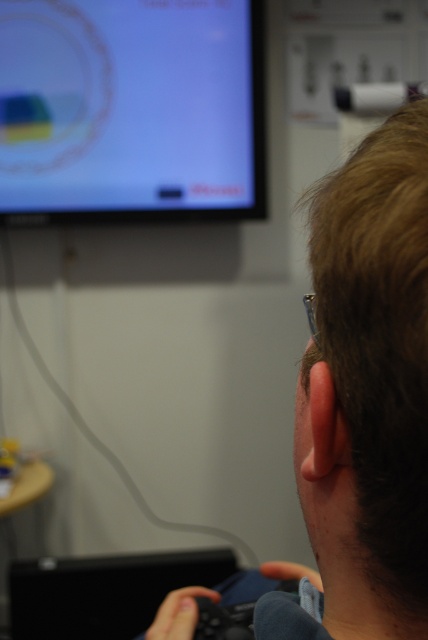
Is matte plastic monitor at upper left closer to camera compared to brown hair at upper right?

Result: No, it is not.

Who is positioned more to the left, matte plastic monitor at upper left or brown hair at upper right?

From the viewer's perspective, matte plastic monitor at upper left appears more on the left side.

Is point (169, 1) closer to camera compared to point (425, 346)?

No, it is not.

Locate an element on the screen. matte plastic monitor at upper left is located at coordinates (x=131, y=109).